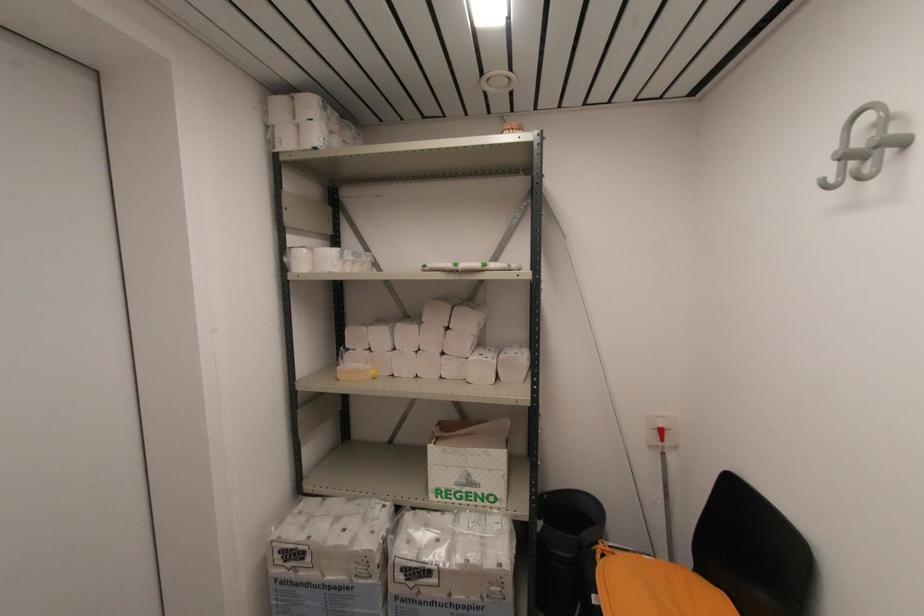
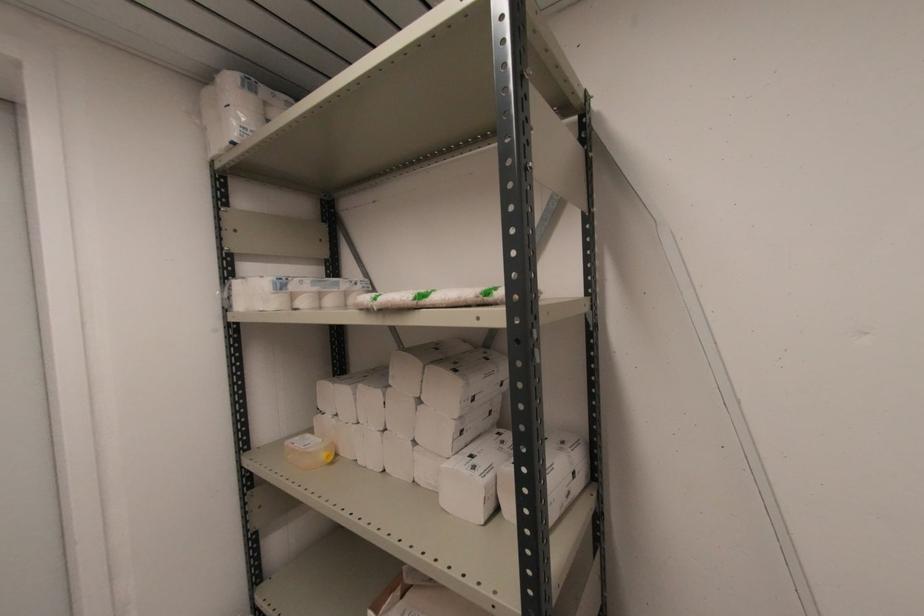
The images are taken continuously from a first-person perspective. In which direction are you moving?

The cameraman walked toward right, forward.